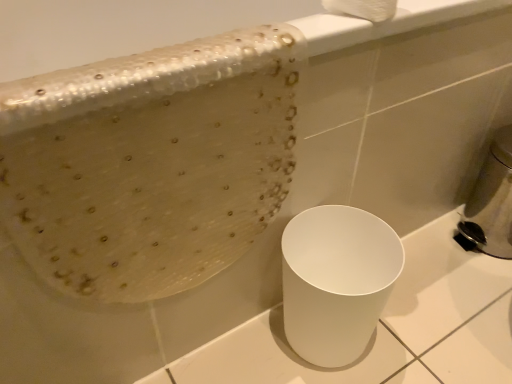
Question: Would you consider white fluffy toilet paper at upper center to be distant from metallic silver soap dispenser at right?

Choices:
 (A) no
 (B) yes

Answer: (A)

Question: Does white fluffy toilet paper at upper center have a larger size compared to metallic silver soap dispenser at right?

Choices:
 (A) yes
 (B) no

Answer: (B)

Question: From a real-world perspective, is white fluffy toilet paper at upper center positioned under metallic silver soap dispenser at right based on gravity?

Choices:
 (A) no
 (B) yes

Answer: (A)

Question: Can you confirm if white fluffy toilet paper at upper center is smaller than metallic silver soap dispenser at right?

Choices:
 (A) yes
 (B) no

Answer: (A)

Question: Is white fluffy toilet paper at upper center further to the viewer compared to metallic silver soap dispenser at right?

Choices:
 (A) yes
 (B) no

Answer: (B)

Question: Does point (475, 200) appear closer or farther from the camera than point (391, 14)?

Choices:
 (A) closer
 (B) farther

Answer: (B)

Question: Considering the positions of metallic silver soap dispenser at right and white fluffy toilet paper at upper center in the image, is metallic silver soap dispenser at right taller or shorter than white fluffy toilet paper at upper center?

Choices:
 (A) short
 (B) tall

Answer: (B)

Question: Considering the positions of metallic silver soap dispenser at right and white fluffy toilet paper at upper center in the image, is metallic silver soap dispenser at right bigger or smaller than white fluffy toilet paper at upper center?

Choices:
 (A) big
 (B) small

Answer: (A)

Question: From the image's perspective, relative to white fluffy toilet paper at upper center, is metallic silver soap dispenser at right above or below?

Choices:
 (A) above
 (B) below

Answer: (B)

Question: Does point (360, 4) appear closer or farther from the camera than point (353, 302)?

Choices:
 (A) farther
 (B) closer

Answer: (B)

Question: From their relative heights in the image, would you say white fluffy toilet paper at upper center is taller or shorter than white glossy trash can at lower right?

Choices:
 (A) short
 (B) tall

Answer: (A)

Question: Looking at their shapes, would you say white fluffy toilet paper at upper center is wider or thinner than white glossy trash can at lower right?

Choices:
 (A) thin
 (B) wide

Answer: (A)

Question: From the image's perspective, is white fluffy toilet paper at upper center located above or below white glossy trash can at lower right?

Choices:
 (A) above
 (B) below

Answer: (A)

Question: Is point (307, 352) positioned closer to the camera than point (394, 11)?

Choices:
 (A) farther
 (B) closer

Answer: (A)

Question: Considering the positions of white glossy trash can at lower right and white fluffy toilet paper at upper center in the image, is white glossy trash can at lower right wider or thinner than white fluffy toilet paper at upper center?

Choices:
 (A) thin
 (B) wide

Answer: (B)